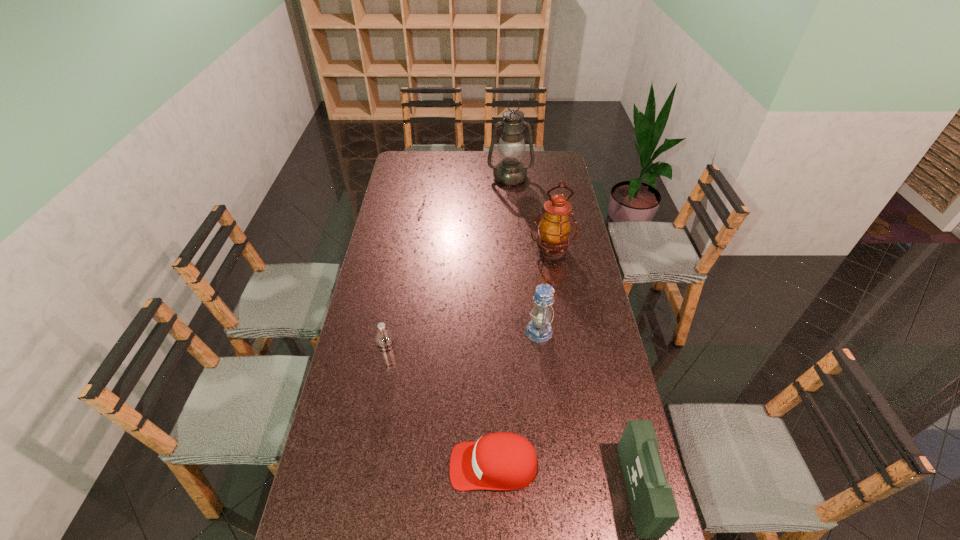
Locate an element on the screen. The height and width of the screenshot is (540, 960). the tallest object is located at coordinates (510, 171).

Find the location of a particular element. the farther oil lamp is located at coordinates (510, 171).

You are a GUI agent. You are given a task and a screenshot of the screen. Output one action in this format:
    pyautogui.click(x=<x>, y=<y>)
    Task: Click on the fifth nearest object
    The image size is (960, 540).
    Given the screenshot: What is the action you would take?
    pyautogui.click(x=554, y=229)

Locate an element on the screen. The height and width of the screenshot is (540, 960). the fifth shortest object is located at coordinates (554, 229).

The height and width of the screenshot is (540, 960). I want to click on the third farthest object, so click(539, 330).

Find the location of `the third tallest object`. the third tallest object is located at coordinates (539, 330).

Where is `the leftmost object`? This screenshot has height=540, width=960. the leftmost object is located at coordinates (384, 338).

The width and height of the screenshot is (960, 540). I want to click on vodka, so click(x=384, y=338).

The width and height of the screenshot is (960, 540). I want to click on the first-aid kit, so click(654, 510).

Where is `baseball cap`? The width and height of the screenshot is (960, 540). baseball cap is located at coordinates (504, 461).